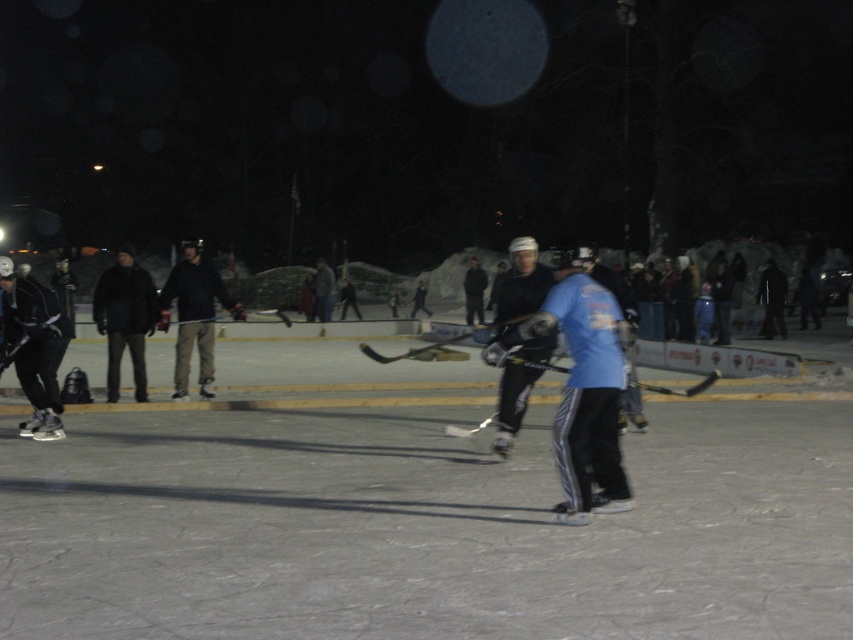
Can you confirm if blue fabric shirt at center is positioned to the left of dark gray pants at center?

No, blue fabric shirt at center is not to the left of dark gray pants at center.

Which is above, blue fabric shirt at center or dark gray pants at center?

dark gray pants at center

Measure the distance between blue fabric shirt at center and camera.

blue fabric shirt at center and camera are 6.41 meters apart.

The width and height of the screenshot is (853, 640). What are the coordinates of `blue fabric shirt at center` in the screenshot? It's located at (582, 388).

Does blue fabric shirt at center have a lesser width compared to black matte hockey stick at center?

Yes, blue fabric shirt at center is thinner than black matte hockey stick at center.

Between blue fabric shirt at center and black matte hockey stick at center, which one has less height?

With less height is black matte hockey stick at center.

Image resolution: width=853 pixels, height=640 pixels. What are the coordinates of `blue fabric shirt at center` in the screenshot? It's located at [x=582, y=388].

Does smooth ice rink at center appear under blue fabric shirt at center?

Yes, smooth ice rink at center is below blue fabric shirt at center.

Who is more forward, (96, 417) or (592, 300)?

Point (592, 300) is in front.

Measure the distance between smooth ice rink at center and camera.

smooth ice rink at center is 14.65 feet away from camera.

You are a GUI agent. You are given a task and a screenshot of the screen. Output one action in this format:
    pyautogui.click(x=<x>, y=<y>)
    Task: Click on the smooth ice rink at center
    
    Given the screenshot: What is the action you would take?
    pyautogui.click(x=424, y=528)